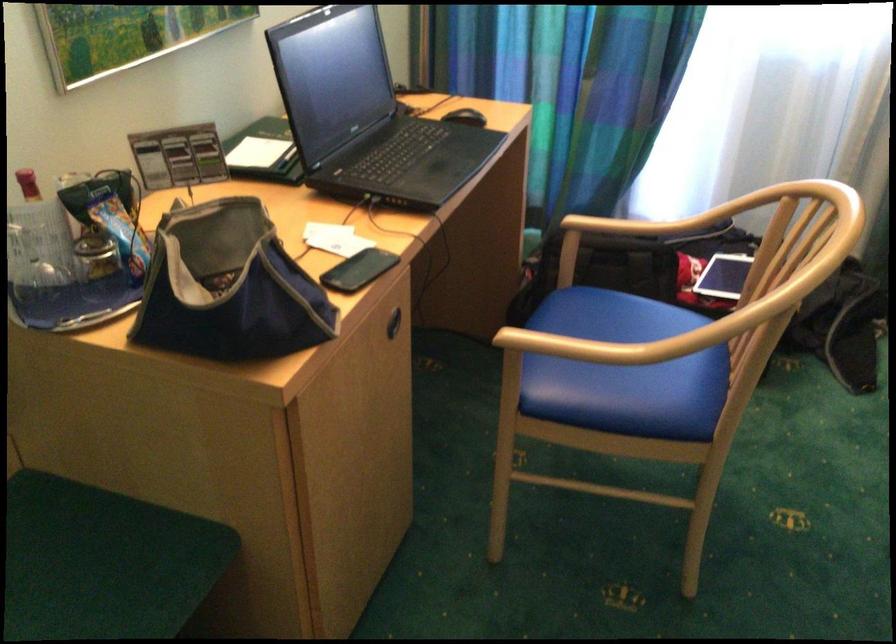
Which object does [228,287] point to?

It corresponds to the blue fabric bag in the image.